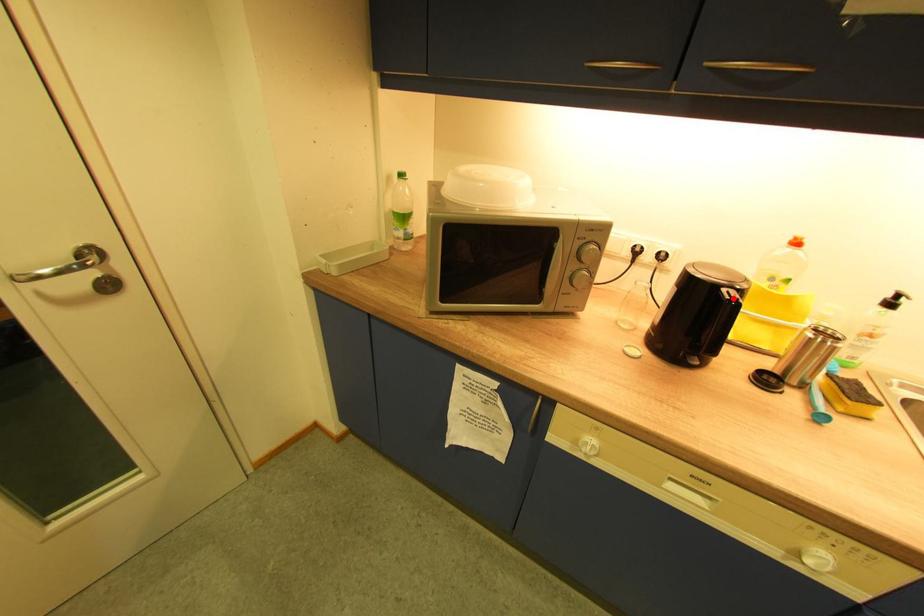
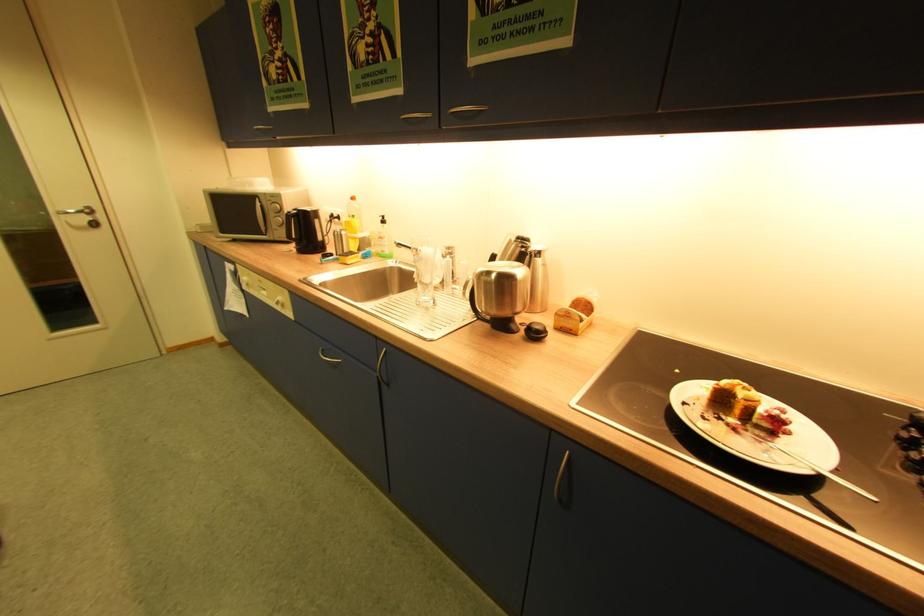
Where in the second image is the point corresponding to the highlighted location from the first image?

(296, 214)